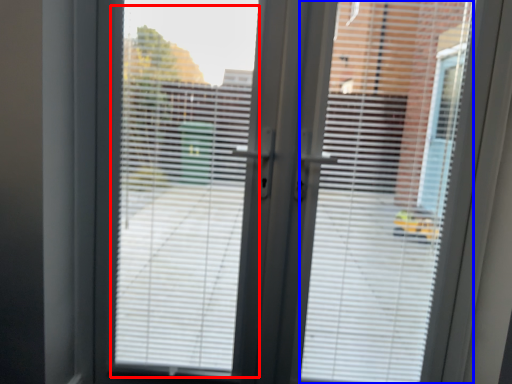
Question: Which object appears closest to the camera in this image, window screen (highlighted by a red box) or blind (highlighted by a blue box)?

Choices:
 (A) window screen
 (B) blind

Answer: (B)